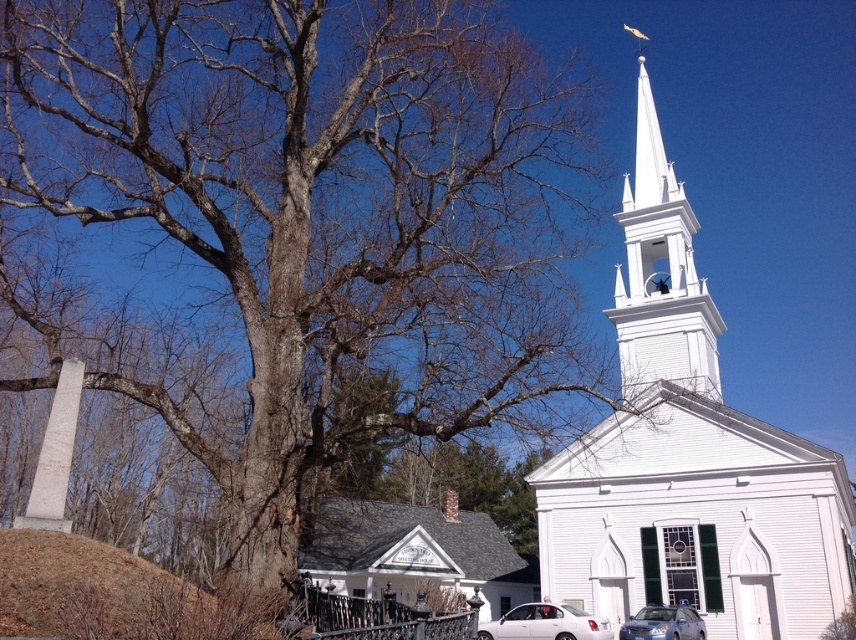
You are a photographer planning to take a picture of the white glossy sedan at center from the front. The black wrought iron fence at lower center might block your view. Based on the scene description, will the fence block the sedan in your photo?

The black wrought iron fence at lower center is much taller than the white glossy sedan at center, so it will block the sedan in your photo.

In the scene shown: You are a photographer wanting to capture the white glossy sedan at center and the brown dirt mound at lower left in the same frame. Based on their positions, which object should you focus on first to ensure both are in view?

The brown dirt mound at lower left is located above the white glossy sedan at center, so you should focus on the white glossy sedan at center first to ensure both are in view.